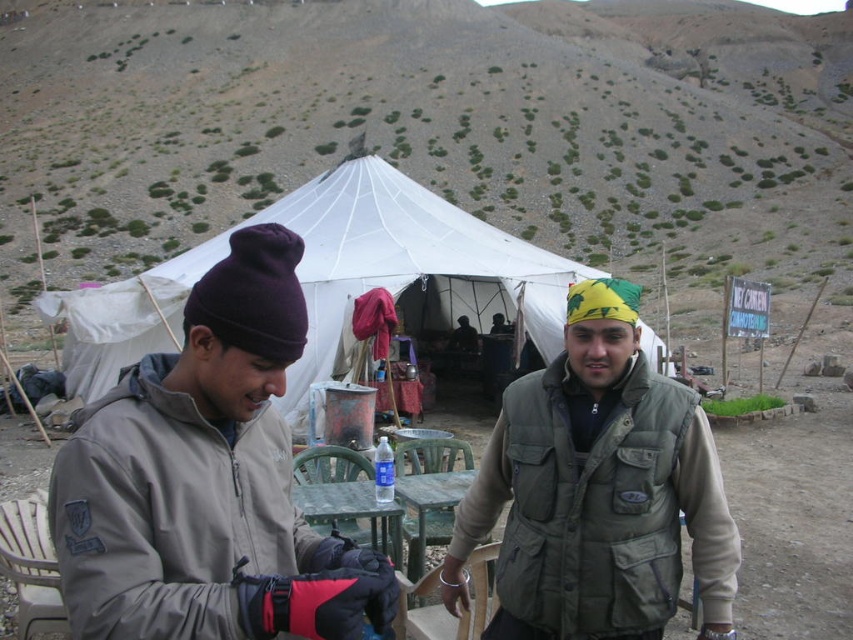
You are planning to take a photo of the gray fleece jacket at center and the green canvas yurt at center. Which object should you focus on first if you want to capture both in the same frame without moving the camera?

You should focus on the gray fleece jacket at center first because it is shorter than the green canvas yurt at center, allowing both to be in the frame when positioned appropriately.

You are a hiker who needs to reach the green canvas yurt at center to take shelter from an incoming storm. You are currently standing next to the gray fleece jacket at center. Can you step directly into the yurt from your current position without moving more than 1 meter?

The gray fleece jacket at center is only 1.16 meters away from the green canvas yurt at center. Since you need to move less than 1 meter to reach it, you cannot step directly into the yurt without moving more than the allowed distance.

You are standing at the base of the mountain in the rugged arid landscape. You see two points marked in the scene. The first point is at coordinates point (120, 634) and the second point is at point (543, 573). Which point is closer to you?

Point (120, 634) is closer to you because it is in front of point (543, 573).